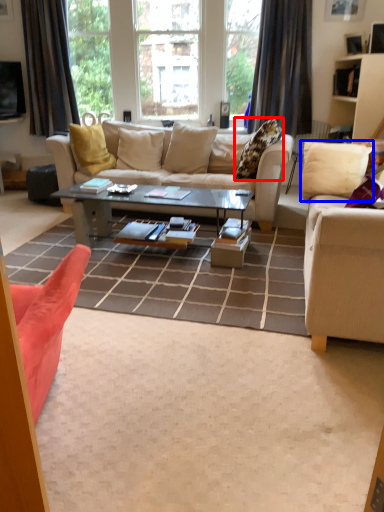
Question: Which object appears closest to the camera in this image, pillow (highlighted by a red box) or pillow (highlighted by a blue box)?

Choices:
 (A) pillow
 (B) pillow

Answer: (B)